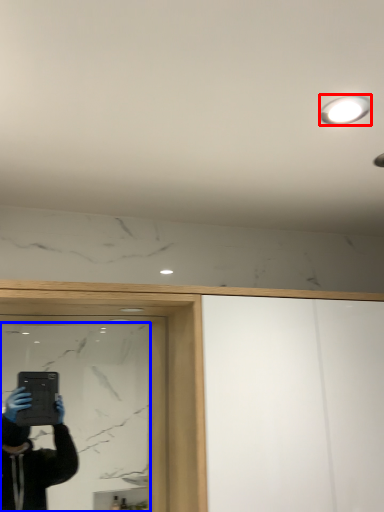
Question: Which of the following is the closest to the observer, light fixture (highlighted by a red box) or mirror (highlighted by a blue box)?

Choices:
 (A) light fixture
 (B) mirror

Answer: (A)